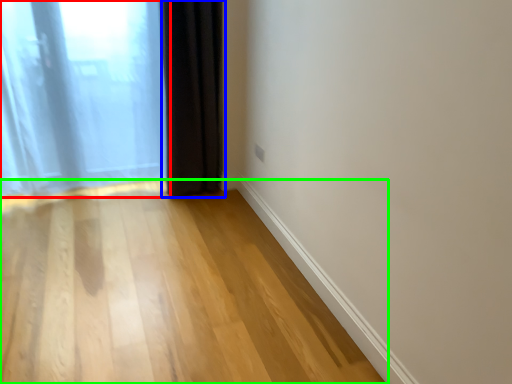
Question: Which object is the farthest from curtain (highlighted by a red box)? Choose among these: curtain (highlighted by a blue box) or corridor (highlighted by a green box).

Choices:
 (A) curtain
 (B) corridor

Answer: (B)